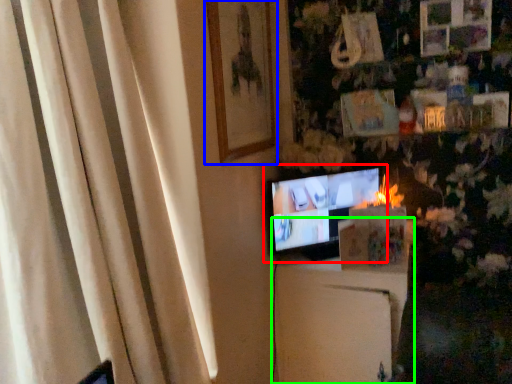
Question: Estimate the real-world distances between objects in this image. Which object is closer to television (highlighted by a red box), picture frame (highlighted by a blue box) or furniture (highlighted by a green box)?

Choices:
 (A) picture frame
 (B) furniture

Answer: (B)